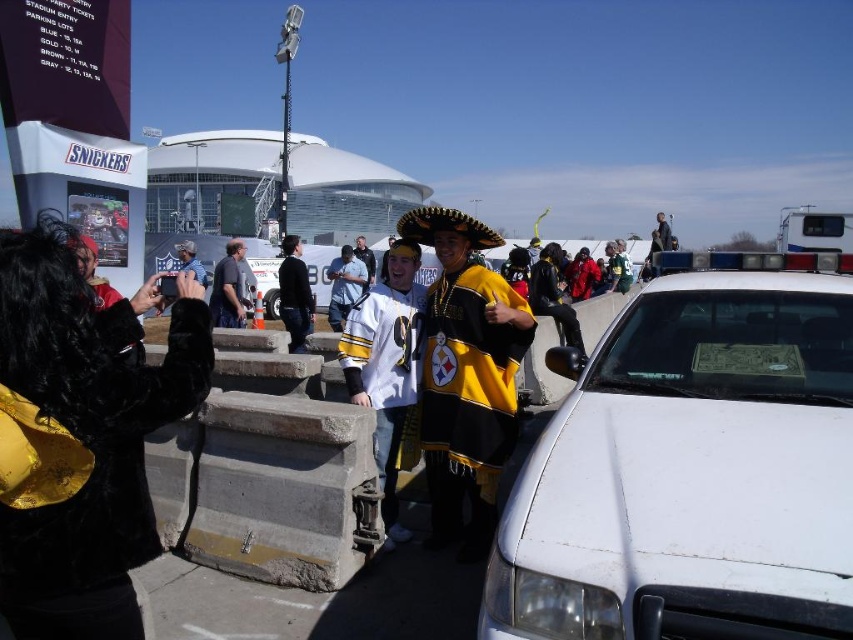
Question: Which object is farther from the camera taking this photo?

Choices:
 (A) black leather jacket at center
 (B) white jersey at center

Answer: (A)

Question: Is black fur coat at left thinner than yellow jersey at center?

Choices:
 (A) no
 (B) yes

Answer: (B)

Question: Can you confirm if black fur coat at left is smaller than yellow jersey at center?

Choices:
 (A) yes
 (B) no

Answer: (A)

Question: Considering the real-world distances, which object is farthest from the dark blue shirt at center?

Choices:
 (A) black fur coat at left
 (B) white jersey at center
 (C) yellow jersey at center

Answer: (C)

Question: Can you confirm if white matte police car at center is positioned to the right of white jersey at center?

Choices:
 (A) yes
 (B) no

Answer: (A)

Question: Among these objects, which one is farthest from the camera?

Choices:
 (A) white matte police car at center
 (B) yellow jersey at center
 (C) black leather jacket at center
 (D) white jersey at center

Answer: (B)